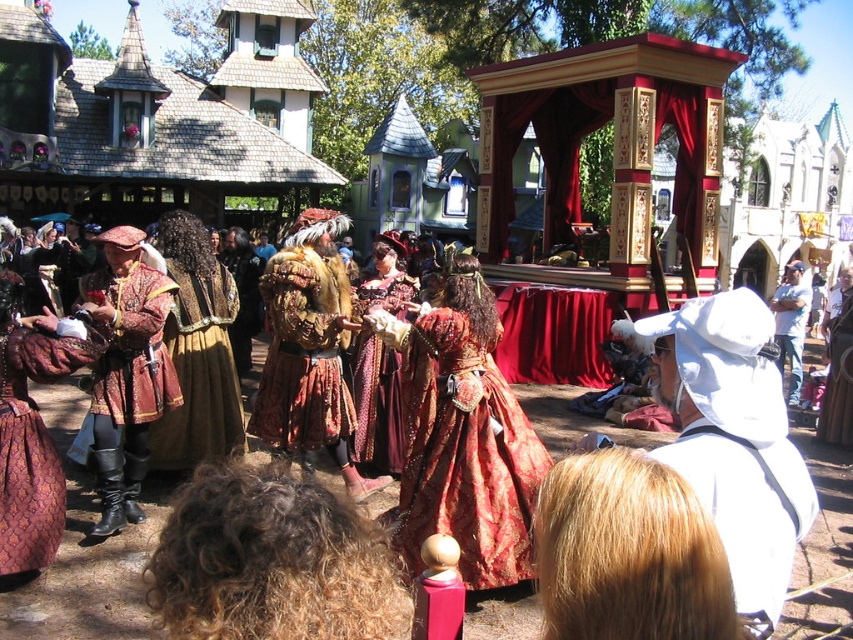
Is point (241, 449) more distant than point (351, 445)?

Yes, point (241, 449) is farther from viewer.

Which of these two, matte gold dress at center or velvet maroon dress at center, stands taller?

Standing taller between the two is velvet maroon dress at center.

Which is in front, point (172, 278) or point (387, 406)?

Point (172, 278) is in front.

Locate an element on the screen. The height and width of the screenshot is (640, 853). matte gold dress at center is located at coordinates (196, 352).

Does shiny gold dress at center have a greater height compared to white cotton bonnet at center?

Incorrect, shiny gold dress at center's height is not larger of white cotton bonnet at center's.

Measure the distance between point (389, 337) and camera.

Point (389, 337) and camera are 17.38 meters apart from each other.

Identify the location of shiny gold dress at center. (463, 436).

Who is lower down, white cotton bonnet at center or white cotton hat at right?

white cotton bonnet at center is lower down.

Between point (787, 460) and point (790, 288), which one is positioned behind?

The point (790, 288) is more distant.

Where is `white cotton bonnet at center`? white cotton bonnet at center is located at coordinates (747, 509).